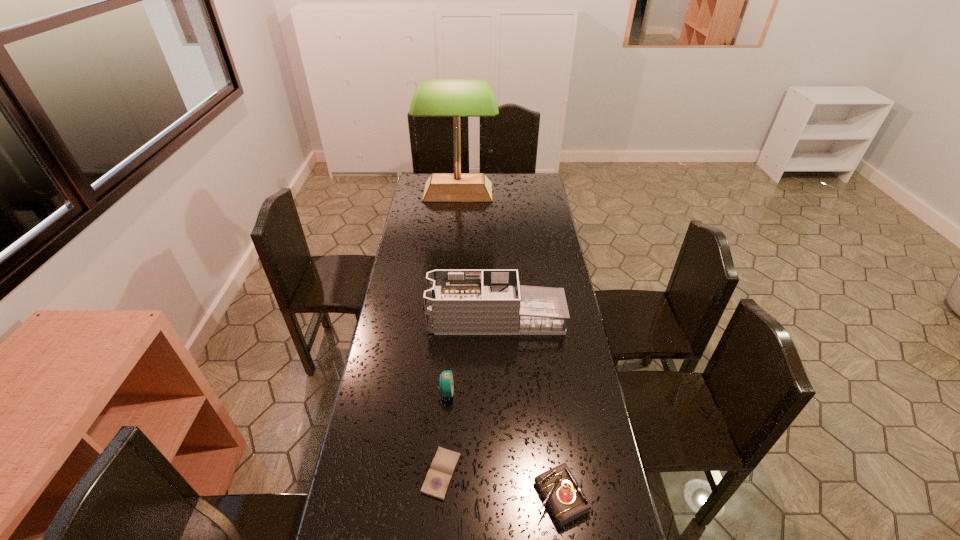
The width and height of the screenshot is (960, 540). In order to click on free space in the image that satisfies the following two spatial constraints: 1. at the entrance of the dollhouse; 2. on the back side of the right diary in this screenshot , I will do `click(503, 497)`.

I want to click on free location that satisfies the following two spatial constraints: 1. on the back side of the second shortest object; 2. at the entrance of the fourth shortest object, so click(538, 319).

The image size is (960, 540). Find the location of `free space that satisfies the following two spatial constraints: 1. on the back side of the taller diary; 2. on the front-facing side of the alarm clock`. free space that satisfies the following two spatial constraints: 1. on the back side of the taller diary; 2. on the front-facing side of the alarm clock is located at coordinates (547, 392).